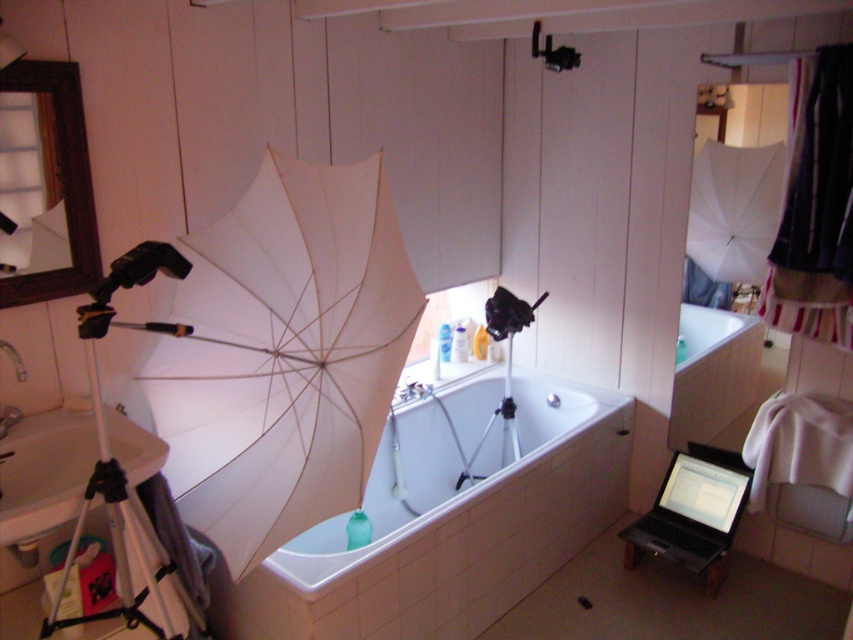
Question: Is white matte umbrella at center to the left of white glossy bathtub at center from the viewer's perspective?

Choices:
 (A) no
 (B) yes

Answer: (B)

Question: Among these objects, which one is farthest from the camera?

Choices:
 (A) black glossy laptop at lower right
 (B) white plastic tripod at left
 (C) white glossy bathtub at center
 (D) white matte umbrella at center

Answer: (A)

Question: Among these points, which one is farthest from the camera?

Choices:
 (A) (138, 252)
 (B) (305, 456)

Answer: (B)

Question: Does white plastic tripod at left appear over black glossy laptop at lower right?

Choices:
 (A) no
 (B) yes

Answer: (B)

Question: Based on their relative distances, which object is farther from the black glossy laptop at lower right?

Choices:
 (A) white glossy bathtub at center
 (B) white plastic tripod at left

Answer: (B)

Question: In this image, where is white matte umbrella at center located relative to white plastic tripod at left?

Choices:
 (A) above
 (B) below

Answer: (A)